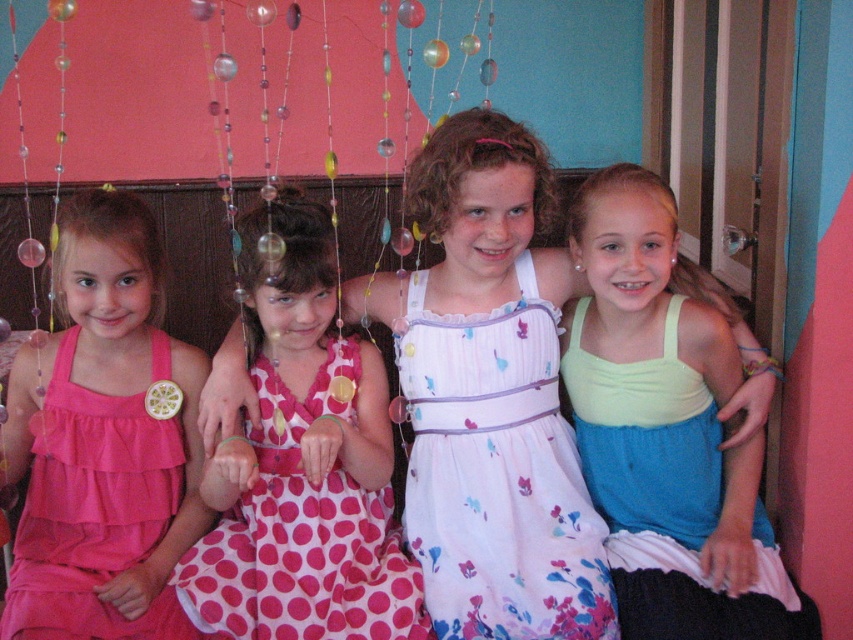
You are a photographer setting up a shoot in the room described. You need to position a backdrop that is 1.5 meters tall. The backdrop must be placed behind the two girls wearing the light green fabric dress at right and the floral cotton dress at center. Considering their heights, will the backdrop be tall enough to cover both?

The light green fabric dress at right is taller than the floral cotton dress at center. Since the backdrop is 1.5 meters tall, it will be sufficient to cover both girls as it exceeds their heights.

You are a photographer setting up for a group photo. You have two dresses in the scene, the light green fabric dress at right and the pink chiffon dress at left. Which dress should you focus on first if you want to capture the larger one in detail?

The light green fabric dress at right is larger in size than the pink chiffon dress at left, so you should focus on the light green fabric dress at right first.